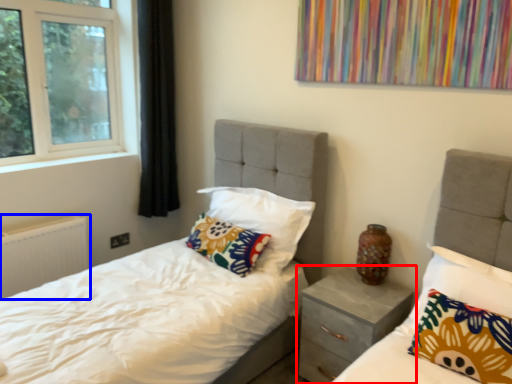
Question: Which object appears closest to the camera in this image, nightstand (highlighted by a red box) or radiator (highlighted by a blue box)?

Choices:
 (A) nightstand
 (B) radiator

Answer: (A)